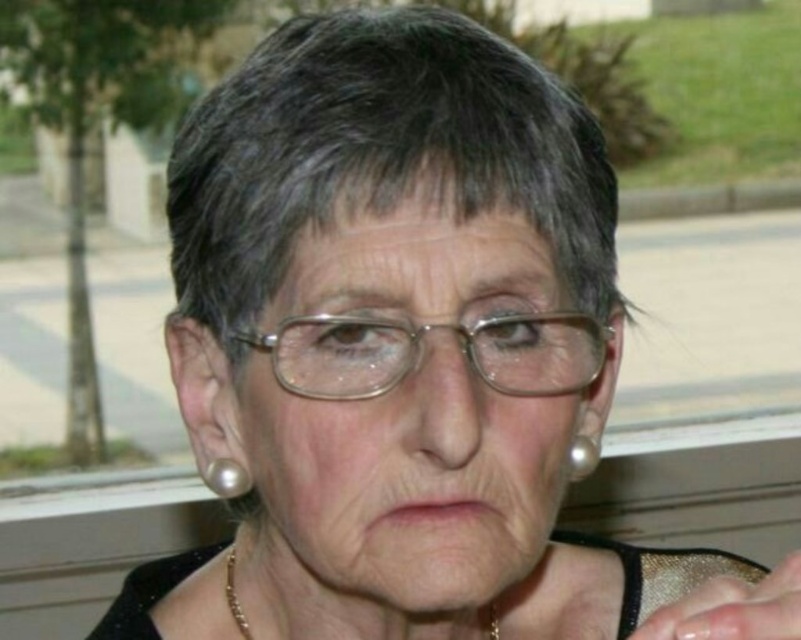
Question: Is transparent plastic hand at lower right wider than pearlelegantearring at lower left?

Choices:
 (A) yes
 (B) no

Answer: (A)

Question: Where is transparent plastic hand at lower right located in relation to gold chain at lower center in the image?

Choices:
 (A) above
 (B) below

Answer: (A)

Question: Which of the following is the farthest from the observer?

Choices:
 (A) (494, 385)
 (B) (493, 609)
 (C) (224, 476)
 (D) (727, 632)

Answer: (B)

Question: Can you confirm if clear plastic glasses at center is smaller than transparent plastic hand at lower right?

Choices:
 (A) no
 (B) yes

Answer: (A)

Question: Which point appears closest to the camera in this image?

Choices:
 (A) (224, 486)
 (B) (582, 456)
 (C) (675, 611)
 (D) (325, 323)

Answer: (C)

Question: Which object appears closest to the camera in this image?

Choices:
 (A) pearlelegantearring at lower left
 (B) gold chain at lower center

Answer: (A)